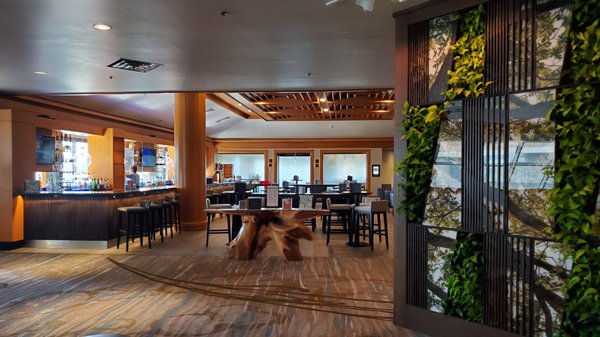
Identify the location of tv screen. The image size is (600, 337). (151, 157), (43, 150).